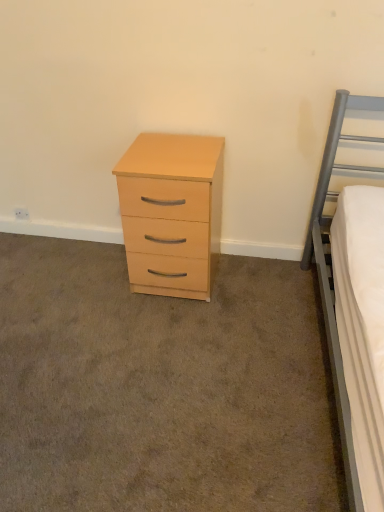
Question: Should I look upward or downward to see light wood/veneer chest of drawers at center?

Choices:
 (A) down
 (B) up

Answer: (B)

Question: Is light wood drawer at center behind light wood/veneer chest of drawers at center?

Choices:
 (A) yes
 (B) no

Answer: (B)

Question: Is light wood drawer at center to the right of light wood/veneer chest of drawers at center from the viewer's perspective?

Choices:
 (A) yes
 (B) no

Answer: (B)

Question: Considering the relative positions of light wood drawer at center and light wood/veneer chest of drawers at center in the image provided, is light wood drawer at center to the left of light wood/veneer chest of drawers at center from the viewer's perspective?

Choices:
 (A) no
 (B) yes

Answer: (B)

Question: Is light wood drawer at center located outside light wood/veneer chest of drawers at center?

Choices:
 (A) no
 (B) yes

Answer: (B)

Question: Is light wood drawer at center far from light wood/veneer chest of drawers at center?

Choices:
 (A) no
 (B) yes

Answer: (A)

Question: From the image's perspective, is light wood drawer at center below light wood/veneer chest of drawers at center?

Choices:
 (A) yes
 (B) no

Answer: (A)

Question: Is light wood/veneer chest of drawers at center far away from light wood drawer at center?

Choices:
 (A) yes
 (B) no

Answer: (B)

Question: Considering the relative sizes of light wood/veneer chest of drawers at center and light wood drawer at center in the image provided, is light wood/veneer chest of drawers at center thinner than light wood drawer at center?

Choices:
 (A) yes
 (B) no

Answer: (A)

Question: Can you see light wood/veneer chest of drawers at center touching light wood drawer at center?

Choices:
 (A) no
 (B) yes

Answer: (A)

Question: From the image's perspective, is light wood/veneer chest of drawers at center over light wood drawer at center?

Choices:
 (A) no
 (B) yes

Answer: (B)

Question: Is the depth of light wood/veneer chest of drawers at center less than that of light wood drawer at center?

Choices:
 (A) no
 (B) yes

Answer: (A)

Question: From the image's perspective, would you say light wood/veneer chest of drawers at center is shown under light wood drawer at center?

Choices:
 (A) no
 (B) yes

Answer: (A)

Question: From a real-world perspective, is light wood/veneer chest of drawers at center positioned above or below light wood drawer at center?

Choices:
 (A) above
 (B) below

Answer: (A)